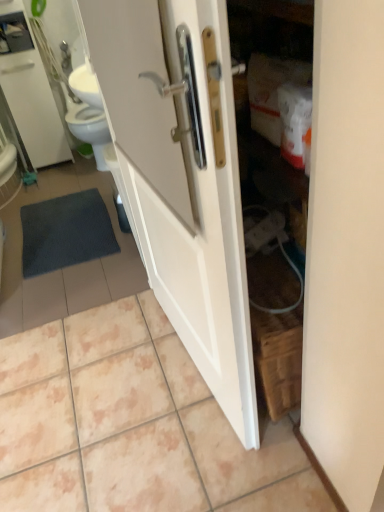
Question: From the image's perspective, is dark gray textured bath mat at lower left above or below white glossy medicine cabinet at upper left?

Choices:
 (A) above
 (B) below

Answer: (B)

Question: Considering the positions of dark gray textured bath mat at lower left and white glossy medicine cabinet at upper left in the image, is dark gray textured bath mat at lower left taller or shorter than white glossy medicine cabinet at upper left?

Choices:
 (A) tall
 (B) short

Answer: (B)

Question: Considering the real-world distances, which object is farthest from the white glossy tile at center?

Choices:
 (A) dark gray textured bath mat at lower left
 (B) white glossy door at center
 (C) white glossy medicine cabinet at upper left

Answer: (C)

Question: Based on their relative distances, which object is farther from the white glossy door at center?

Choices:
 (A) white glossy medicine cabinet at upper left
 (B) dark gray textured bath mat at lower left
 (C) white glossy tile at center

Answer: (A)